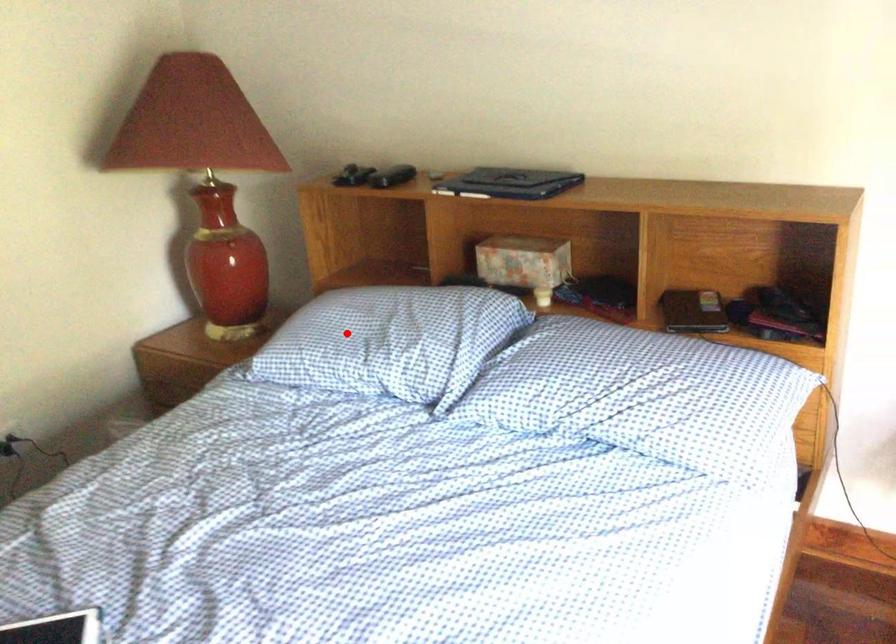
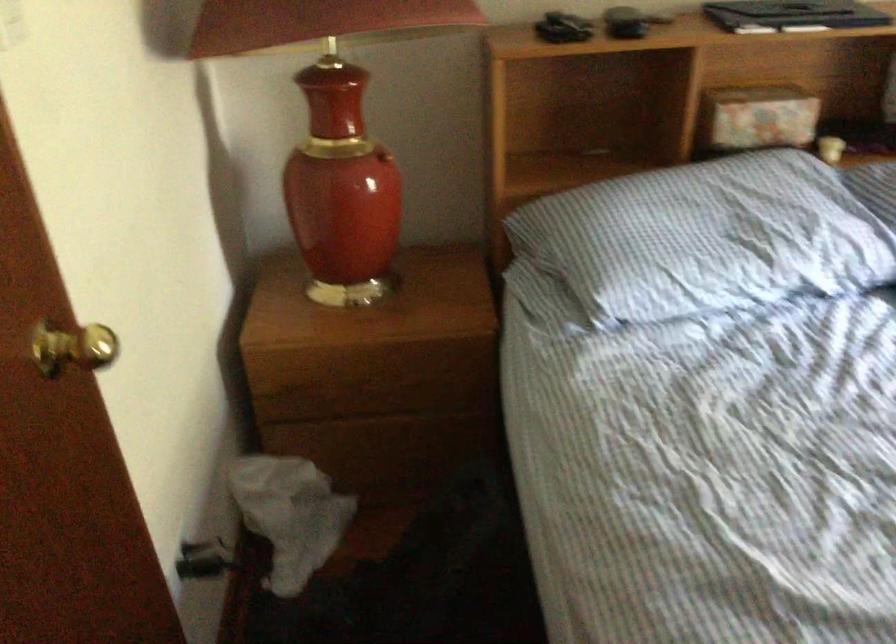
Question: I am providing you with two images of the same scene from different viewpoints. Image1 has a red point marked. In image2, the corresponding 3D location appears at what relative position? Reply with the corresponding letter.

Choices:
 (A) Closer
 (B) Farther

Answer: (A)